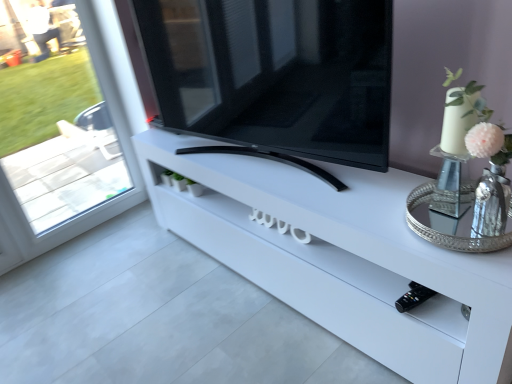
In order to click on vacant space situated on the left part of silver metallic tray at right in this screenshot , I will do `click(369, 212)`.